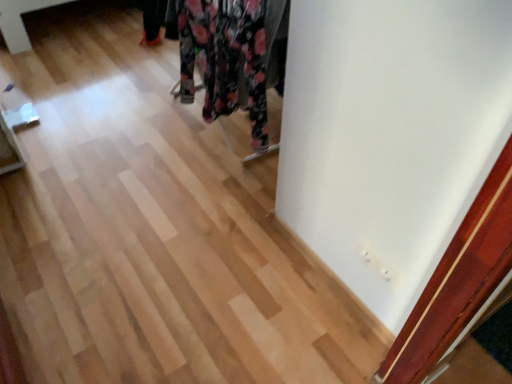
Locate an element on the screen. blank area beneath floral fabric dress at center (from a real-world perspective) is located at coordinates (200, 136).